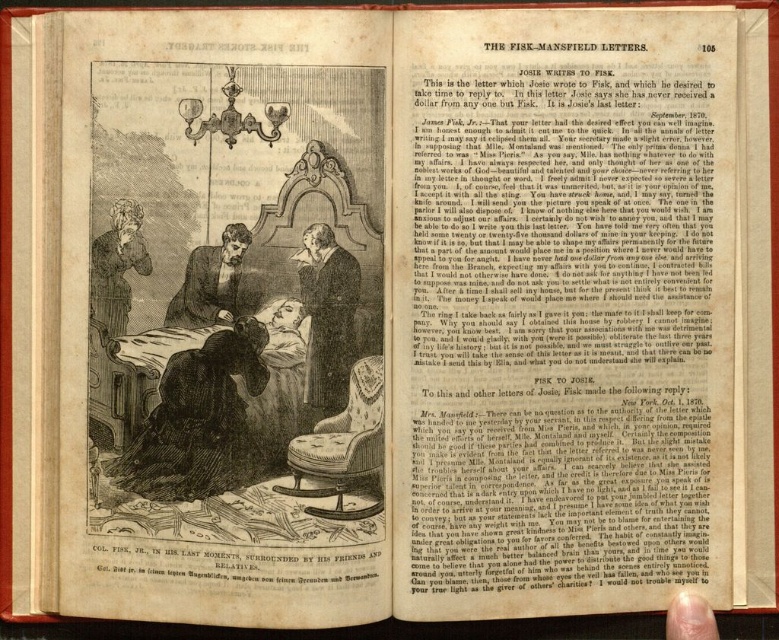
Question: In this image, where is smooth black coat at center located relative to dark brown leather jacket at center?

Choices:
 (A) above
 (B) below

Answer: (B)

Question: Estimate the real-world distances between objects in this image. Which object is farther from the dark brown leather jacket at center?

Choices:
 (A) smooth black coat at center
 (B) smooth pinkish skin at lower right

Answer: (B)

Question: Does dark brown leather jacket at center come behind smooth pinkish skin at lower right?

Choices:
 (A) no
 (B) yes

Answer: (B)

Question: Which object is farther from the camera taking this photo?

Choices:
 (A) smooth pinkish skin at lower right
 (B) dark brown leather jacket at center

Answer: (B)

Question: Is smooth black coat at center above dark brown leather jacket at center?

Choices:
 (A) no
 (B) yes

Answer: (A)

Question: Among these objects, which one is farthest from the camera?

Choices:
 (A) dark brown leather jacket at center
 (B) smooth black coat at center
 (C) smooth pinkish skin at lower right

Answer: (A)